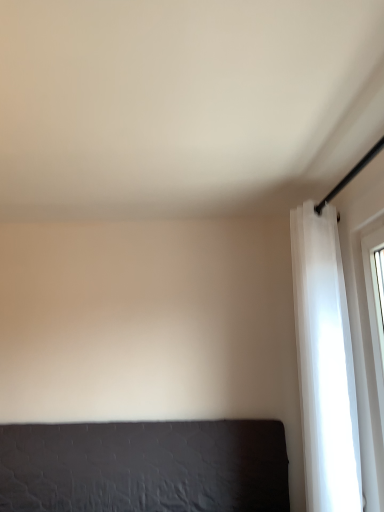
Find the location of a particular element. The image size is (384, 512). white sheer curtain at right is located at coordinates (325, 364).

Measure the distance between white sheer curtain at right and camera.

They are 5.49 feet apart.

In the scene shown: In order to face white sheer curtain at right, should I rotate leftwards or rightwards?

Turn right by 17.394 degrees to look at white sheer curtain at right.

What do you see at coordinates (325, 364) in the screenshot? I see `white sheer curtain at right` at bounding box center [325, 364].

Find the location of a particular element. This screenshot has width=384, height=512. dark gray fabric bed at lower left is located at coordinates (145, 466).

This screenshot has width=384, height=512. What do you see at coordinates (145, 466) in the screenshot?
I see `dark gray fabric bed at lower left` at bounding box center [145, 466].

Locate an element on the screen. The height and width of the screenshot is (512, 384). white sheer curtain at right is located at coordinates (325, 364).

Is white sheer curtain at right to the right of dark gray fabric bed at lower left from the viewer's perspective?

Yes, white sheer curtain at right is to the right of dark gray fabric bed at lower left.

Considering the relative positions of white sheer curtain at right and dark gray fabric bed at lower left in the image provided, is white sheer curtain at right in front of dark gray fabric bed at lower left?

That is True.

Which is behind, point (315, 290) or point (166, 449)?

The point (166, 449) is more distant.

From the image's perspective, is white sheer curtain at right over dark gray fabric bed at lower left?

Yes, from the image's perspective, white sheer curtain at right is over dark gray fabric bed at lower left.

From a real-world perspective, does white sheer curtain at right stand above dark gray fabric bed at lower left?

Indeed, from a real-world perspective, white sheer curtain at right stands above dark gray fabric bed at lower left.

Considering the relative sizes of white sheer curtain at right and dark gray fabric bed at lower left in the image provided, is white sheer curtain at right thinner than dark gray fabric bed at lower left?

Incorrect, the width of white sheer curtain at right is not less than that of dark gray fabric bed at lower left.

Between white sheer curtain at right and dark gray fabric bed at lower left, which one has more height?

white sheer curtain at right.

Considering the relative sizes of white sheer curtain at right and dark gray fabric bed at lower left in the image provided, is white sheer curtain at right smaller than dark gray fabric bed at lower left?

No.

Is white sheer curtain at right completely or partially outside of dark gray fabric bed at lower left?

Yes.

Is white sheer curtain at right not close to dark gray fabric bed at lower left?

No.

Is white sheer curtain at right oriented towards dark gray fabric bed at lower left?

No, white sheer curtain at right does not turn towards dark gray fabric bed at lower left.

What's the angular difference between white sheer curtain at right and dark gray fabric bed at lower left's facing directions?

88.1 degrees separate the facing orientations of white sheer curtain at right and dark gray fabric bed at lower left.

Locate an element on the screen. furniture beneath the white sheer curtain at right (from a real-world perspective) is located at coordinates (145, 466).

Considering the positions of objects dark gray fabric bed at lower left and white sheer curtain at right in the image provided, who is more to the left, dark gray fabric bed at lower left or white sheer curtain at right?

dark gray fabric bed at lower left.

Between dark gray fabric bed at lower left and white sheer curtain at right, which one is positioned behind?

dark gray fabric bed at lower left is further away from the camera.

Is point (86, 470) closer to camera compared to point (341, 286)?

No, it is not.

From the image's perspective, is dark gray fabric bed at lower left above or below white sheer curtain at right?

dark gray fabric bed at lower left is situated lower than white sheer curtain at right in the image.

From a real-world perspective, which is physically above, dark gray fabric bed at lower left or white sheer curtain at right?

white sheer curtain at right, from a real-world perspective.

Does dark gray fabric bed at lower left have a greater width compared to white sheer curtain at right?

No, dark gray fabric bed at lower left is not wider than white sheer curtain at right.

Considering the sizes of dark gray fabric bed at lower left and white sheer curtain at right in the image, is dark gray fabric bed at lower left taller or shorter than white sheer curtain at right?

Clearly, dark gray fabric bed at lower left is shorter compared to white sheer curtain at right.

Does dark gray fabric bed at lower left have a smaller size compared to white sheer curtain at right?

Indeed, dark gray fabric bed at lower left has a smaller size compared to white sheer curtain at right.

Is dark gray fabric bed at lower left not within white sheer curtain at right?

Yes.

Is dark gray fabric bed at lower left not close to white sheer curtain at right?

No, there isn't a large distance between dark gray fabric bed at lower left and white sheer curtain at right.

Is dark gray fabric bed at lower left facing away from white sheer curtain at right?

No, dark gray fabric bed at lower left is not facing away from white sheer curtain at right.

Can you tell me how much dark gray fabric bed at lower left and white sheer curtain at right differ in facing direction?

88.1 degrees.

This screenshot has width=384, height=512. Find the location of `curtain in front of the dark gray fabric bed at lower left`. curtain in front of the dark gray fabric bed at lower left is located at coordinates [x=325, y=364].

Find the location of `furniture below the white sheer curtain at right (from the image's perspective)`. furniture below the white sheer curtain at right (from the image's perspective) is located at coordinates (145, 466).

The width and height of the screenshot is (384, 512). What are the coordinates of `furniture behind the white sheer curtain at right` in the screenshot? It's located at (145, 466).